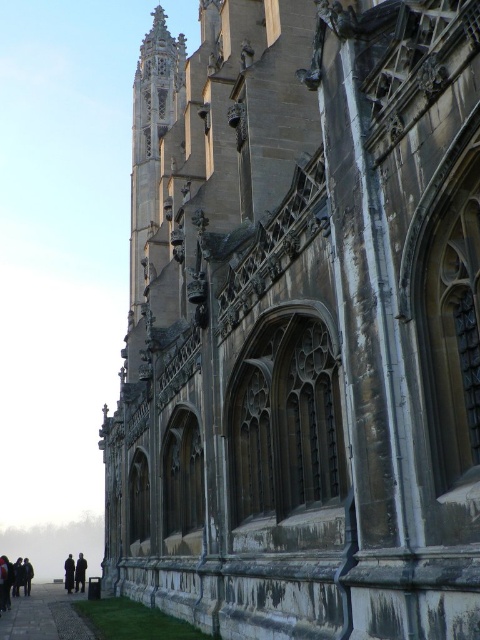
Question: Which is farther from the dark gray jacket at lower left?

Choices:
 (A) dark brown coat at lower left
 (B) dark gray coat at lower left
 (C) paved stone path at lower left

Answer: (C)

Question: Can you confirm if paved stone path at lower left is thinner than dark brown coat at lower left?

Choices:
 (A) yes
 (B) no

Answer: (A)

Question: Which point appears farthest from the camera in this image?

Choices:
 (A) (68, 561)
 (B) (82, 564)

Answer: (A)

Question: Can you confirm if dark brown coat at lower left is positioned to the left of dark gray jacket at lower left?

Choices:
 (A) no
 (B) yes

Answer: (A)

Question: Which of the following is the farthest from the observer?

Choices:
 (A) paved stone path at lower left
 (B) dark brown coat at lower left

Answer: (B)

Question: Where is dark brown coat at lower left located in relation to dark gray jacket at lower left in the image?

Choices:
 (A) above
 (B) below

Answer: (A)